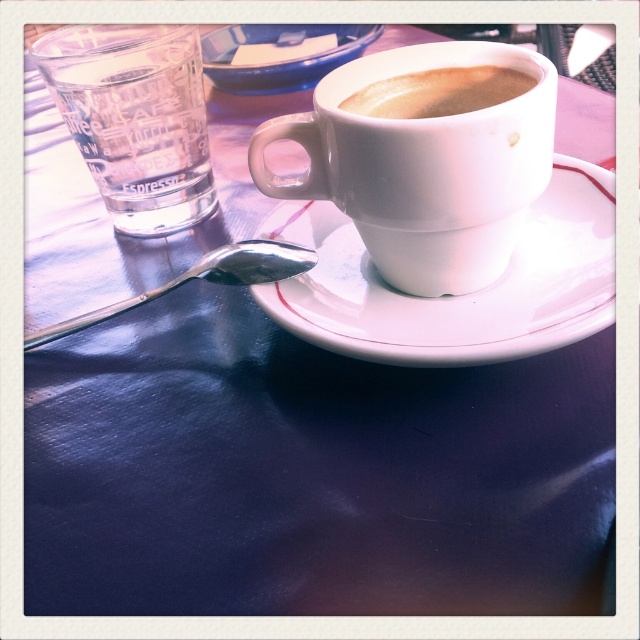
Looking at this image, you are a barista arranging items on a table. You have a white matte cup at center and a transparent glass at left. If you want to place a saucer under the cup, which item should you move to make space?

You should move the transparent glass at left to make space for the saucer under the white matte cup at center because the white matte cup at center might be wider than the transparent glass at left, requiring more space.

You are a barista who needs to place a 15 cm wide tray exactly where the white matte cup at center is currently located. Can you estimate if the tray will fit without overlapping the cup?

The white matte cup at center is 21.29 centimeters from the camera. Since the tray is 15 cm wide, it should fit as long as the space around the cup allows for the tray to be placed without overlapping. However, the exact placement depends on the available space around the cup, which isn

From the picture: You are a barista arranging items on a table. You have a white matte cup at center and a matte ceramic cup at upper center. Which cup should you place closer to the edge of the table to ensure stability, considering their widths?

The white matte cup at center is wider than the matte ceramic cup at upper center, so placing the wider cup closer to the edge would provide better stability due to its larger base.